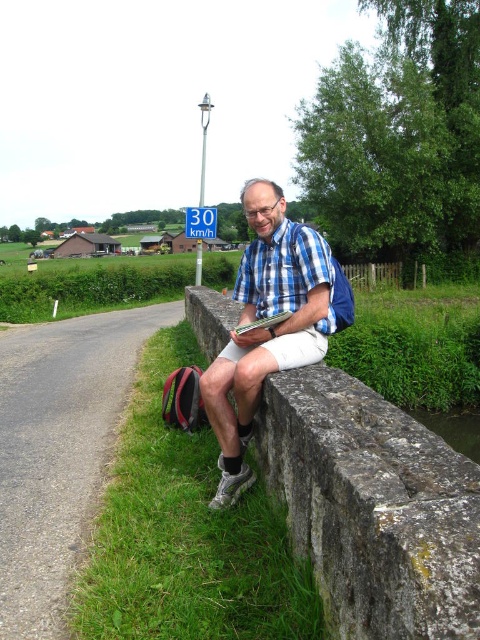
From the picture: You are a photographer standing at the scene described. You want to capture a photo that includes both the man sitting on the stone wall and the green grass at lower left. Given that your camera has a maximum focus range of 7 feet, will you be able to capture both subjects in focus without moving your position?

→ The green grass at lower left is 6.78 feet away from the camera. Since the maximum focus range is 7 feet, the distance is within the limit. Therefore, both the man on the stone wall and the green grass at lower left can be captured in focus.

You are a hiker who wants to sit down for a rest. You see the green grass at lower left and the blue plaid shirt at center. Which location is lower in elevation?

The green grass at lower left is below the blue plaid shirt at center, so the green grass at lower left is lower in elevation.